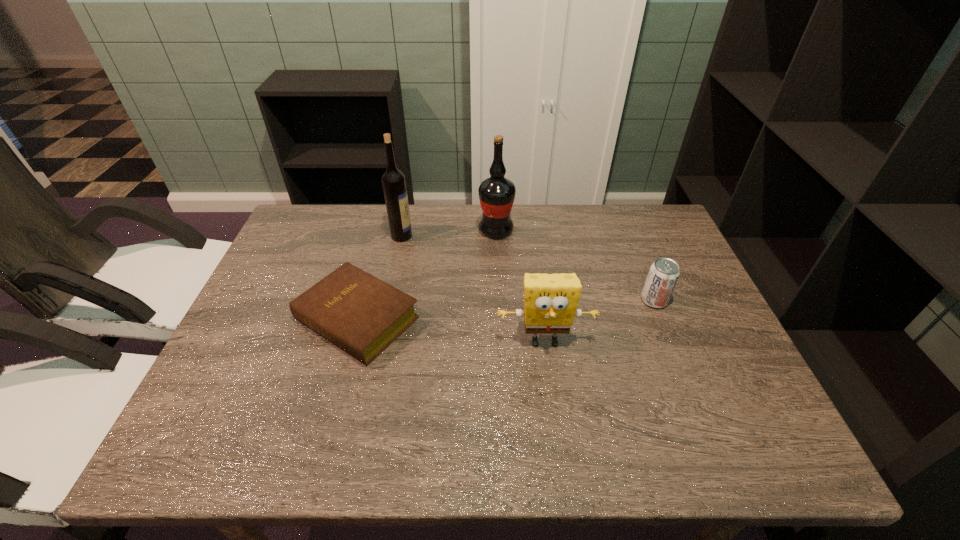
Point out which object is positioned as the fourth nearest to the left wine bottle. Please provide its 2D coordinates. Your answer should be formatted as a tuple, i.e. [(x, y)], where the tuple contains the x and y coordinates of a point satisfying the conditions above.

[(663, 275)]

The height and width of the screenshot is (540, 960). What are the coordinates of `object that stands as the third closest to the second shortest object` in the screenshot? It's located at (362, 315).

Find the location of a particular element. This screenshot has width=960, height=540. free space that satisfies the following two spatial constraints: 1. on the back side of the right wine bottle; 2. on the left side of the shortest object is located at coordinates (381, 230).

You are a GUI agent. You are given a task and a screenshot of the screen. Output one action in this format:
    pyautogui.click(x=<x>, y=<y>)
    Task: Click on the free space that satisfies the following two spatial constraints: 1. on the label of the left wine bottle; 2. on the front side of the shortest object
    
    Given the screenshot: What is the action you would take?
    pyautogui.click(x=384, y=319)

The image size is (960, 540). What are the coordinates of `vacant region that satisfies the following two spatial constraints: 1. on the back side of the rightmost object; 2. on the label of the left wine bottle` in the screenshot? It's located at (629, 235).